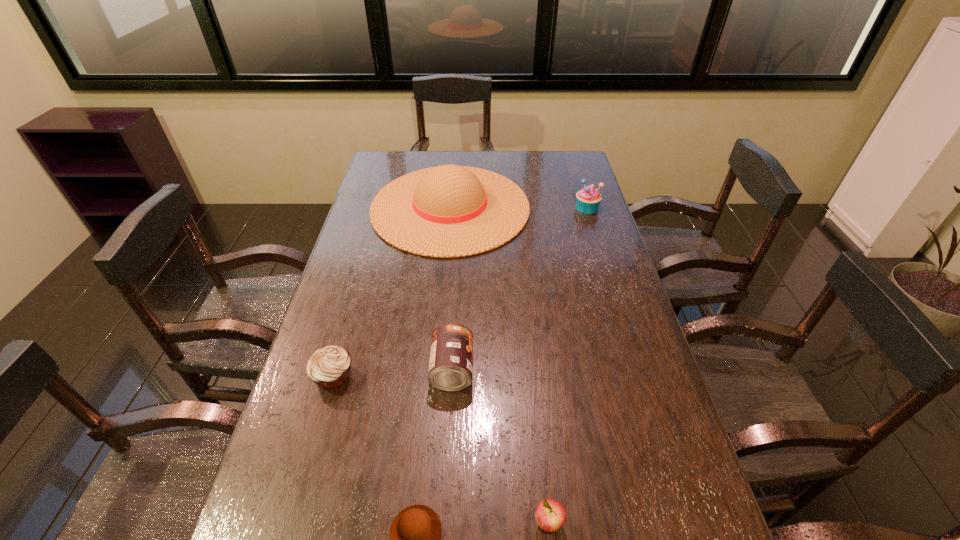
In the image, there is a desktop. Where is `free space at the far right corner`? free space at the far right corner is located at coordinates (549, 152).

Identify the location of free space between the apple and the second farthest muffin. This screenshot has height=540, width=960. (441, 449).

Where is `empty space that is in between the farthest muffin and the apple`? This screenshot has width=960, height=540. empty space that is in between the farthest muffin and the apple is located at coordinates (567, 365).

The height and width of the screenshot is (540, 960). What are the coordinates of `free space between the can and the apple` in the screenshot? It's located at point(500,446).

Identify the location of free space between the apple and the bonnet. (499, 365).

The image size is (960, 540). What are the coordinates of `free space between the leftmost muffin and the tallest object` in the screenshot? It's located at 392,292.

This screenshot has height=540, width=960. What are the coordinates of `empty location between the can and the rightmost object` in the screenshot? It's located at (519, 288).

Identify which object is located as the fifth nearest to the can. Please provide its 2D coordinates. Your answer should be formatted as a tuple, i.e. [(x, y)], where the tuple contains the x and y coordinates of a point satisfying the conditions above.

[(588, 199)]

Where is `object that stands as the fourth closest to the second farthest muffin`? The width and height of the screenshot is (960, 540). object that stands as the fourth closest to the second farthest muffin is located at coordinates (550, 515).

Where is `the third closest muffin to the bonnet`? The width and height of the screenshot is (960, 540). the third closest muffin to the bonnet is located at coordinates (415, 535).